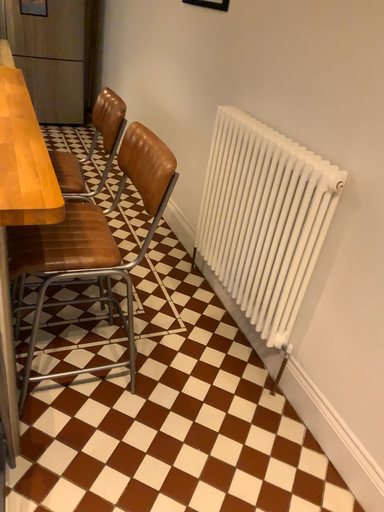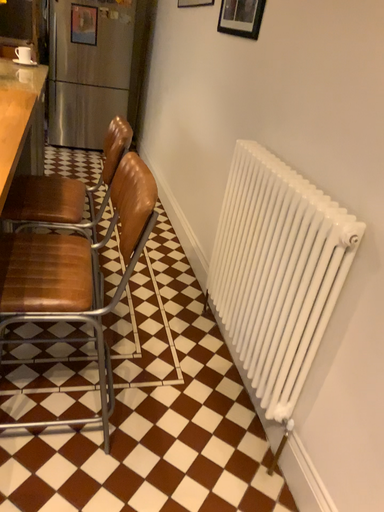
Question: How did the camera likely rotate when shooting the video?

Choices:
 (A) rotated right
 (B) rotated left

Answer: (B)